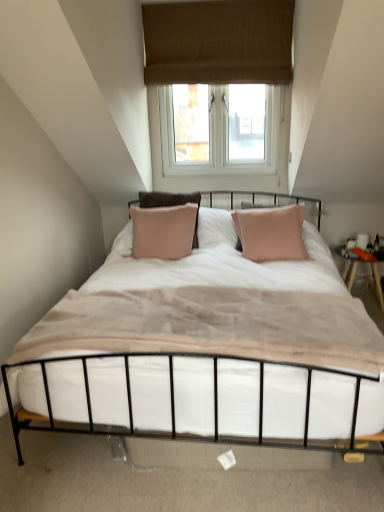
Question: Would you consider brown fabric window at upper center to be distant from metallic white bed at center?

Choices:
 (A) no
 (B) yes

Answer: (B)

Question: Is brown fabric window at upper center to the right of metallic white bed at center from the viewer's perspective?

Choices:
 (A) no
 (B) yes

Answer: (A)

Question: Is brown fabric window at upper center aimed at metallic white bed at center?

Choices:
 (A) no
 (B) yes

Answer: (A)

Question: From a real-world perspective, is brown fabric window at upper center over metallic white bed at center?

Choices:
 (A) yes
 (B) no

Answer: (A)

Question: Is brown fabric window at upper center wider than metallic white bed at center?

Choices:
 (A) yes
 (B) no

Answer: (B)

Question: In terms of size, does metallic white bed at center appear bigger or smaller than white soft mattress at center?

Choices:
 (A) small
 (B) big

Answer: (B)

Question: Is metallic white bed at center in front of or behind white soft mattress at center in the image?

Choices:
 (A) front
 (B) behind

Answer: (A)

Question: From a real-world perspective, is metallic white bed at center above or below white soft mattress at center?

Choices:
 (A) above
 (B) below

Answer: (B)

Question: Considering the positions of metallic white bed at center and white soft mattress at center in the image, is metallic white bed at center taller or shorter than white soft mattress at center?

Choices:
 (A) short
 (B) tall

Answer: (A)

Question: From the image's perspective, relative to brown fabric window at upper center, is white soft mattress at center above or below?

Choices:
 (A) below
 (B) above

Answer: (A)

Question: Looking at the image, does white soft mattress at center seem bigger or smaller compared to brown fabric window at upper center?

Choices:
 (A) small
 (B) big

Answer: (B)

Question: From a real-world perspective, is white soft mattress at center positioned above or below brown fabric window at upper center?

Choices:
 (A) below
 (B) above

Answer: (A)

Question: Considering their positions, is white soft mattress at center located in front of or behind brown fabric window at upper center?

Choices:
 (A) front
 (B) behind

Answer: (A)

Question: From their relative heights in the image, would you say white soft mattress at center is taller or shorter than metallic white bed at center?

Choices:
 (A) short
 (B) tall

Answer: (B)

Question: From a real-world perspective, is white soft mattress at center physically located above or below metallic white bed at center?

Choices:
 (A) above
 (B) below

Answer: (A)